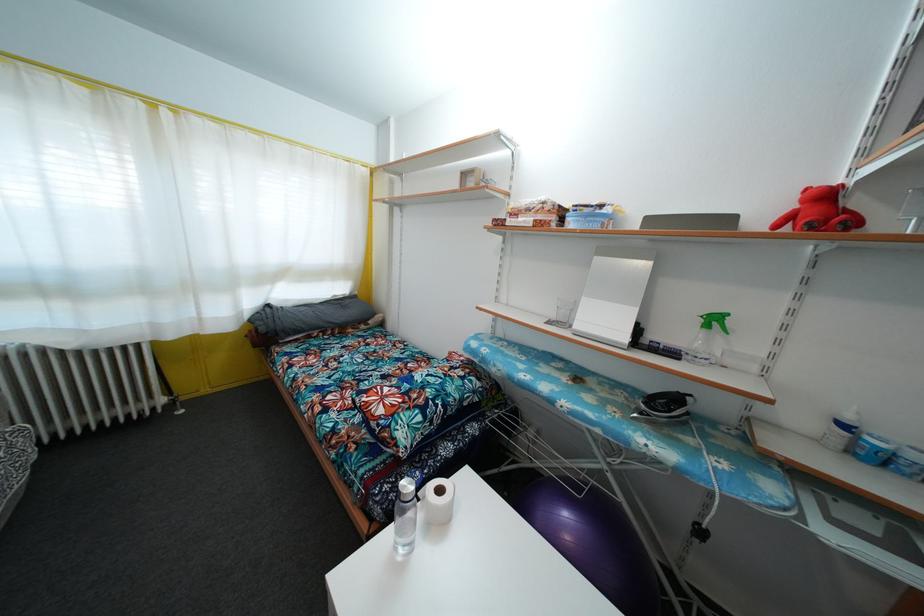
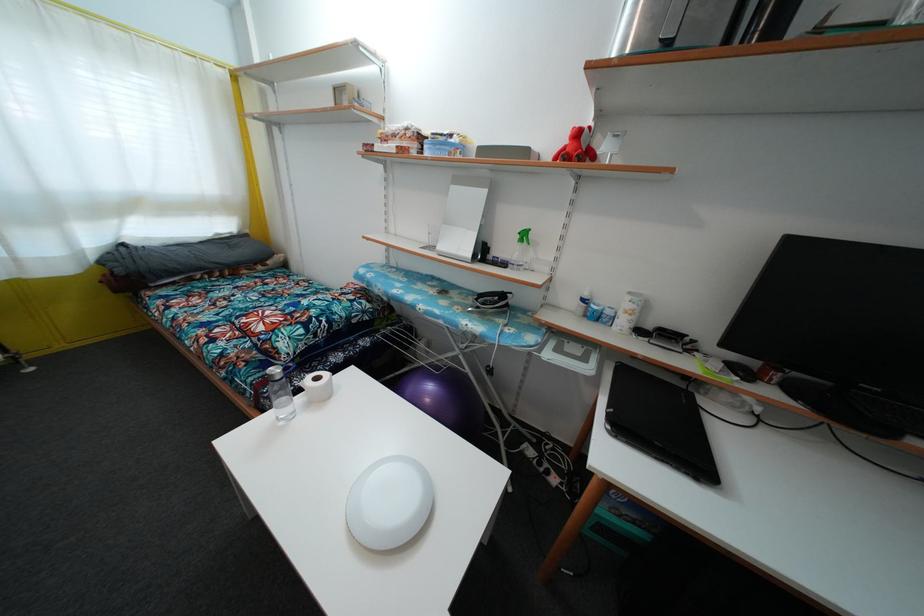
Find the pixel in the second image that matches point (572, 545) in the first image.

(431, 407)